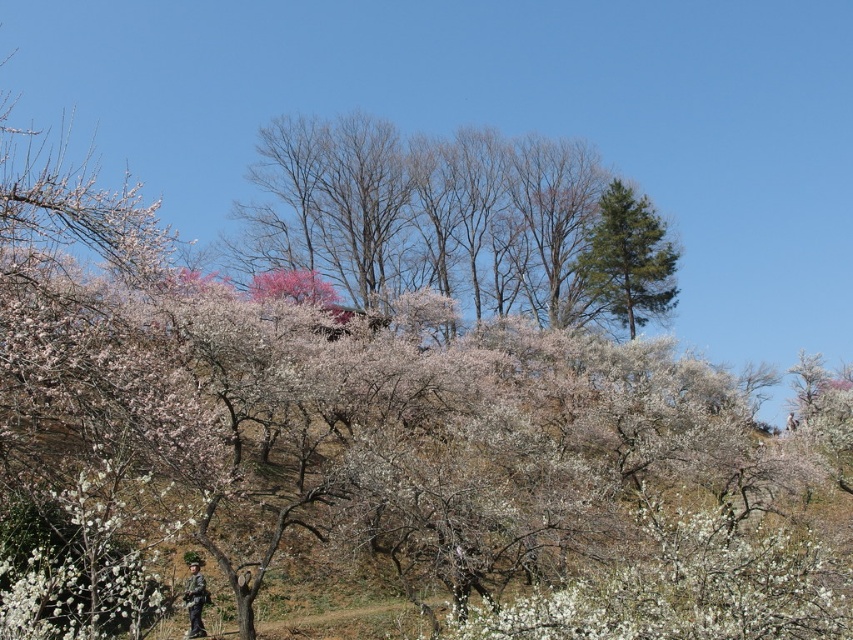
You are an ornithologist studying bird nesting sites. You observe the scene and notice the bare branches at upper center. Based on their position, can you determine if these branches are suitable for building a nest?

The bare branches at upper center are located at coordinates point (457,221). Since they are positioned in the upper center, they may provide a stable and elevated location for nesting, which is ideal for many bird species.